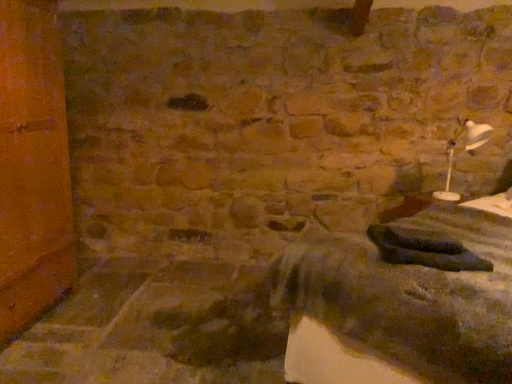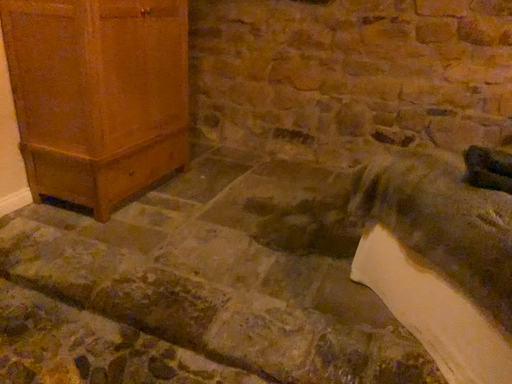
Question: Which way did the camera rotate in the video?

Choices:
 (A) rotated right
 (B) rotated left

Answer: (B)